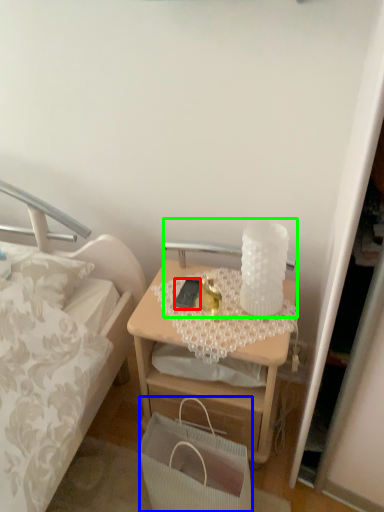
Question: Which is farther away from mobile phone (highlighted by a red box)? handbag (highlighted by a blue box) or table lamp (highlighted by a green box)?

Choices:
 (A) handbag
 (B) table lamp

Answer: (A)